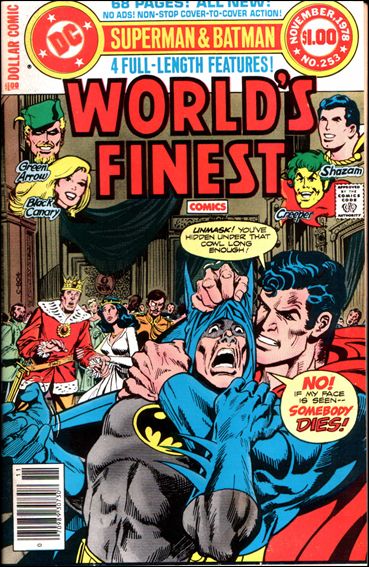
Where is `pillars`? The image size is (369, 567). pillars is located at coordinates (164, 274), (45, 279).